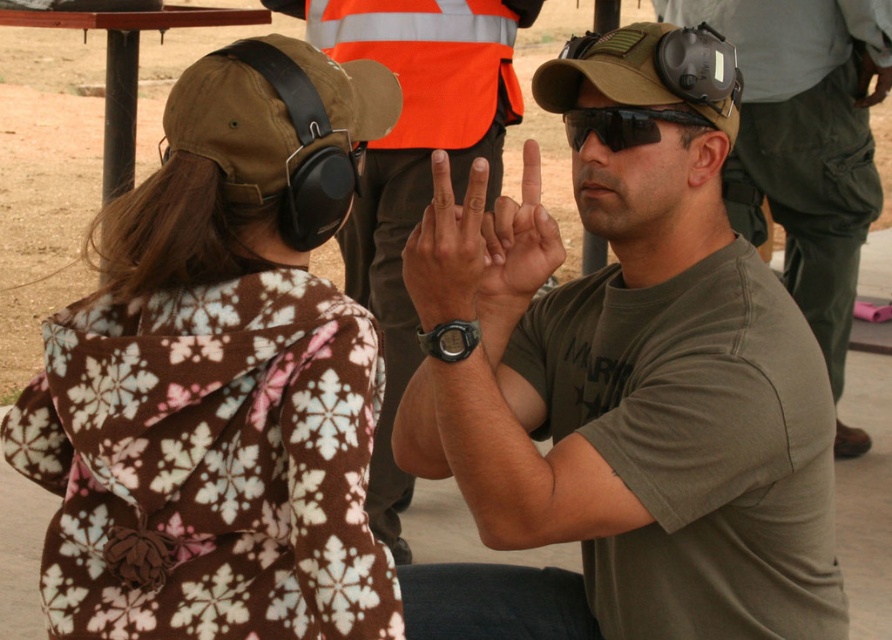
Is matte olive green t-shirt at center above matte black watch at center?

Correct, matte olive green t-shirt at center is located above matte black watch at center.

Is matte olive green t-shirt at center smaller than matte black watch at center?

Result: Incorrect, matte olive green t-shirt at center is not smaller in size than matte black watch at center.

Who is more distant from viewer, (819, 275) or (410, 300)?

Point (819, 275)

This screenshot has width=892, height=640. Identify the location of matte olive green t-shirt at center. (805, 140).

Between olive green t-shirt at center and black matte goggles at center, which one appears on the right side from the viewer's perspective?

From the viewer's perspective, black matte goggles at center appears more on the right side.

Based on the photo, who is shorter, olive green t-shirt at center or black matte goggles at center?

Standing shorter between the two is black matte goggles at center.

Where is `olive green t-shirt at center`? The width and height of the screenshot is (892, 640). olive green t-shirt at center is located at coordinates (620, 394).

Who is taller, orange reflective vest at center or brown fabric baseball hat at center?

Standing taller between the two is orange reflective vest at center.

Does orange reflective vest at center appear under brown fabric baseball hat at center?

Correct, orange reflective vest at center is located below brown fabric baseball hat at center.

Which is behind, point (381, 456) or point (661, 38)?

Positioned behind is point (381, 456).

At what (x,y) coordinates should I click in order to perform the action: click on orange reflective vest at center. Please return your answer as a coordinate pair (x, y). The width and height of the screenshot is (892, 640). Looking at the image, I should click on (414, 164).